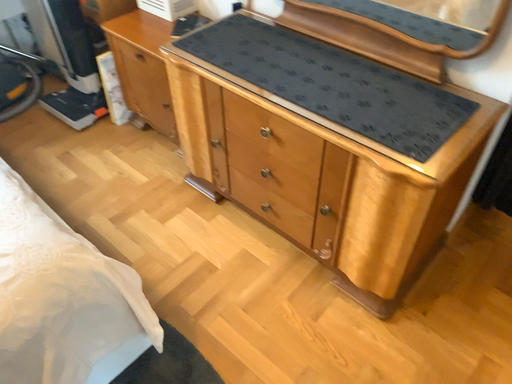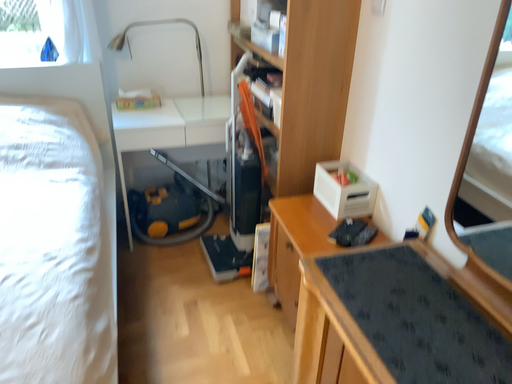
Question: How did the camera likely rotate when shooting the video?

Choices:
 (A) rotated left
 (B) rotated right

Answer: (A)